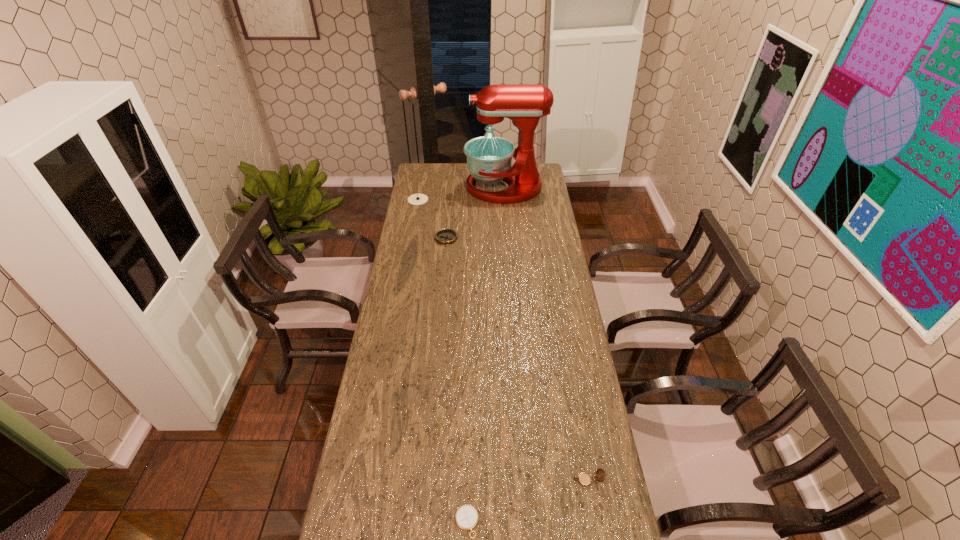
Where is `vacant space that satisfies the following two spatial constraints: 1. on the front-facing side of the mixer; 2. on the front side of the third compass from right to left`? vacant space that satisfies the following two spatial constraints: 1. on the front-facing side of the mixer; 2. on the front side of the third compass from right to left is located at coordinates (508, 239).

At what (x,y) coordinates should I click in order to perform the action: click on vacant space that satisfies the following two spatial constraints: 1. on the front side of the shortest object; 2. on the right side of the second shortest object. Please return your answer as a coordinate pair (x, y). This screenshot has height=540, width=960. Looking at the image, I should click on (420, 522).